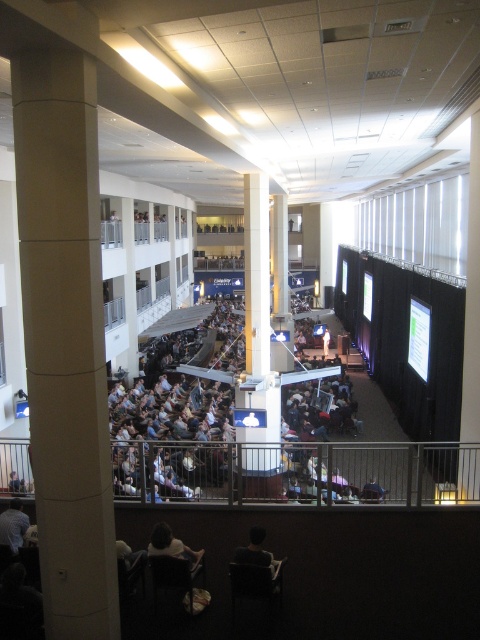
You are an event planner standing on the balcony and want to ensure there is a clear path between the white concrete column at center and the dark gray fabric crowd at center. Based on their positions, can you walk directly from the column to the crowd without obstacles?

The white concrete column at center is to the left of dark gray fabric crowd at center, so there is a direct path between them. You can walk directly from the column to the crowd without obstacles.

You are a stage manager preparing for a live event. You need to place a 3.5 meter wide stage backdrop between the white concrete column at center and the dark gray fabric crowd at center. Is there enough space to fit the backdrop without it blocking the crowd or the column?

The distance between the white concrete column at center and the dark gray fabric crowd at center is 8.74 meters. Since the backdrop is only 3.5 meters wide, there is sufficient space to place it between them without blocking either the column or the crowd. The remaining space would be 8.74m minus 3.5m, which equals 5.24 meters, allowing for adequate clearance on both sides.

You are a photographer standing on the balcony and want to take a photo of the light brown fabric shirt at lower left and the dark brown leather chair at lower center. Which object is located to the left of the other?

The light brown fabric shirt at lower left is positioned on the left side of dark brown leather chair at lower center, so the light brown fabric shirt at lower left is to the left of the dark brown leather chair at lower center.